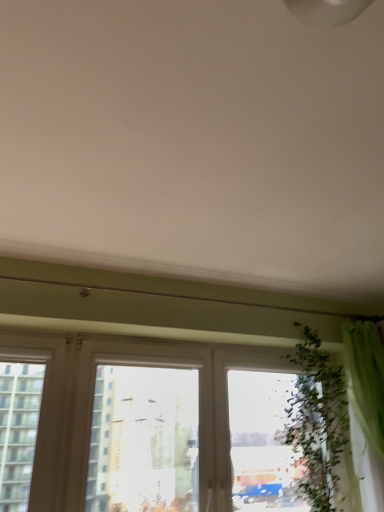
Question: In terms of height, does transparent glass window at center look taller or shorter compared to green fabric curtain at right?

Choices:
 (A) short
 (B) tall

Answer: (A)

Question: Relative to green fabric curtain at right, is transparent glass window at center in front or behind?

Choices:
 (A) front
 (B) behind

Answer: (A)

Question: Which object is the closest to the transparent glass window at center?

Choices:
 (A) green leafy plant at right
 (B) green fabric curtain at right

Answer: (A)

Question: Based on their relative distances, which object is farther from the green fabric curtain at right?

Choices:
 (A) green leafy plant at right
 (B) transparent glass window at center

Answer: (B)